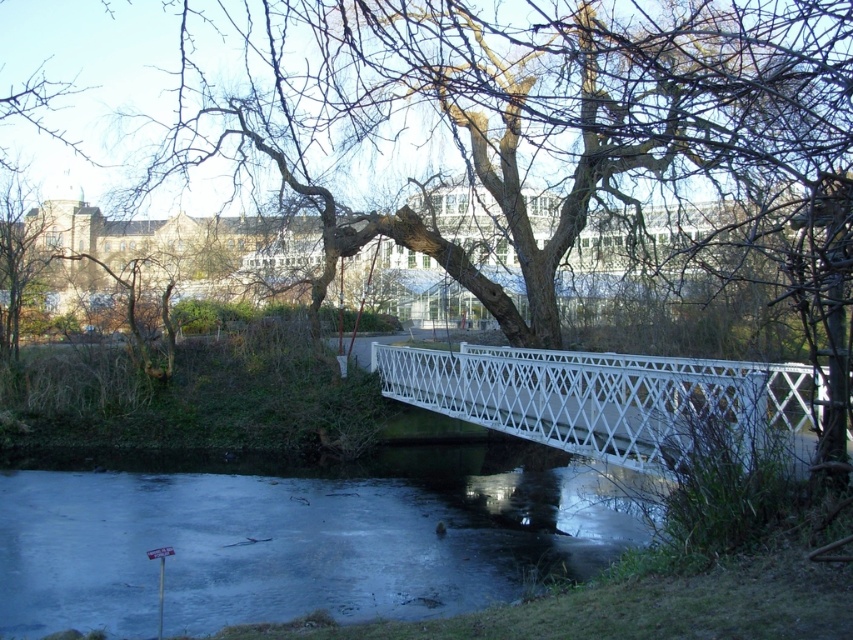
You are a hiker trying to cross the frozen ice at lower center to reach the white lattice bridge at center. Can you safely walk across the ice if the bridge is 2 meters wide and the ice is 3 meters wide?

The frozen ice at lower center is wider than the white lattice bridge at center, so the ice is 3 meters wide and the bridge is 2 meters wide. Since the ice is wider, it should be stable enough to walk across safely.

You are standing at the bottom left corner of the image near the signpost. You want to cross the bridge to reach the other side. Which direction should you walk to avoid the frozen ice at lower center?

The frozen ice at lower center is located at point coordinates, so you should walk towards the upper right direction to avoid it.

You are a hiker who wants to cross the white lattice bridge at center but notices the frozen ice at lower center nearby. Based on the scene, which direction should you avoid stepping to stay safe?

The frozen ice at lower center is to the left of the white lattice bridge at center. To stay safe, avoid stepping to the left side near the frozen ice at lower center since it might be thinner or less stable compared to the solid bridge structure.